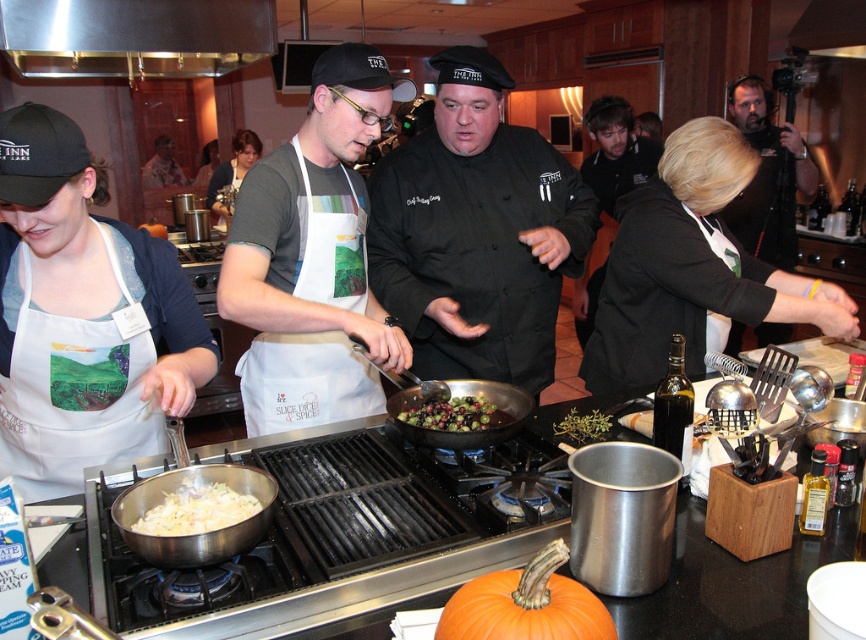
Which is behind, point (179, 8) or point (145, 225)?

Positioned behind is point (145, 225).

Find the location of `stainless steel exhaust hood at upper center`. stainless steel exhaust hood at upper center is located at coordinates (134, 36).

Based on the photo, does black matte apron at center appear under green glossy olives at center?

No.

Which is more to the left, black matte apron at center or green glossy olives at center?

Positioned to the left is green glossy olives at center.

This screenshot has width=866, height=640. I want to click on black matte apron at center, so click(692, 268).

Identify the location of black matte camera at upper right. (767, 177).

Does black matte camera at upper right come in front of matte white apron at center?

Yes.

Does point (813, 177) come closer to viewer compared to point (236, 160)?

Yes, point (813, 177) is closer to viewer.

Where is `black matte camera at upper right`? This screenshot has height=640, width=866. black matte camera at upper right is located at coordinates (767, 177).